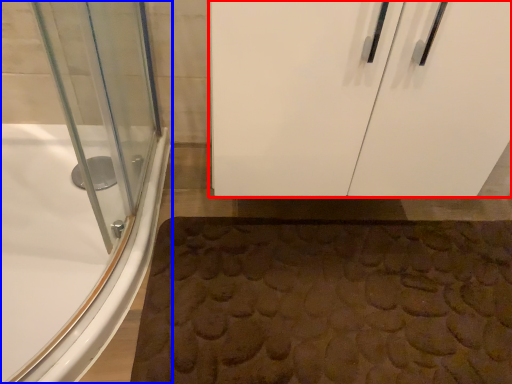
Question: Which of the following is the closest to the observer, door (highlighted by a red box) or bathtub (highlighted by a blue box)?

Choices:
 (A) door
 (B) bathtub

Answer: (A)